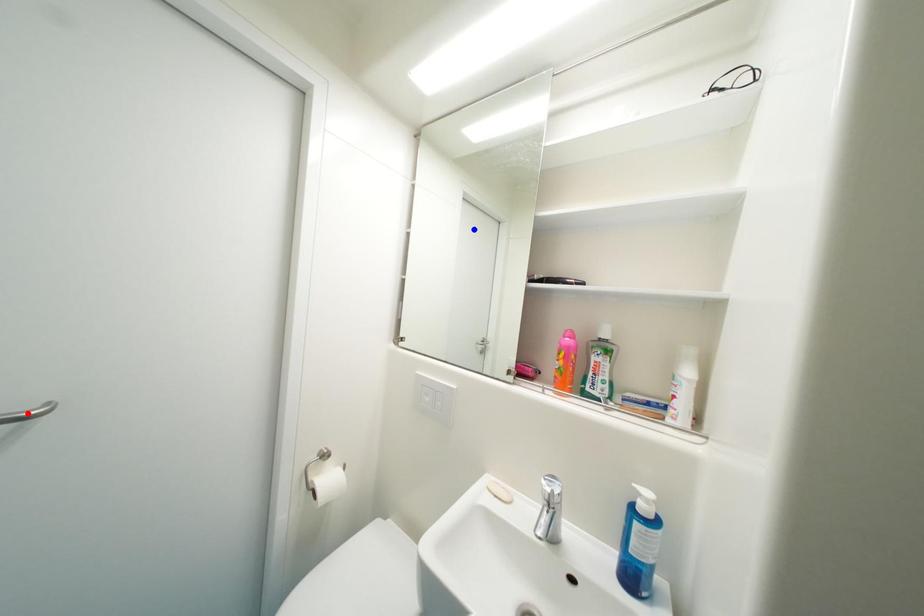
Question: Two points are marked on the image. Which point is closer to the camera?

Choices:
 (A) Blue point is closer.
 (B) Red point is closer.

Answer: (B)